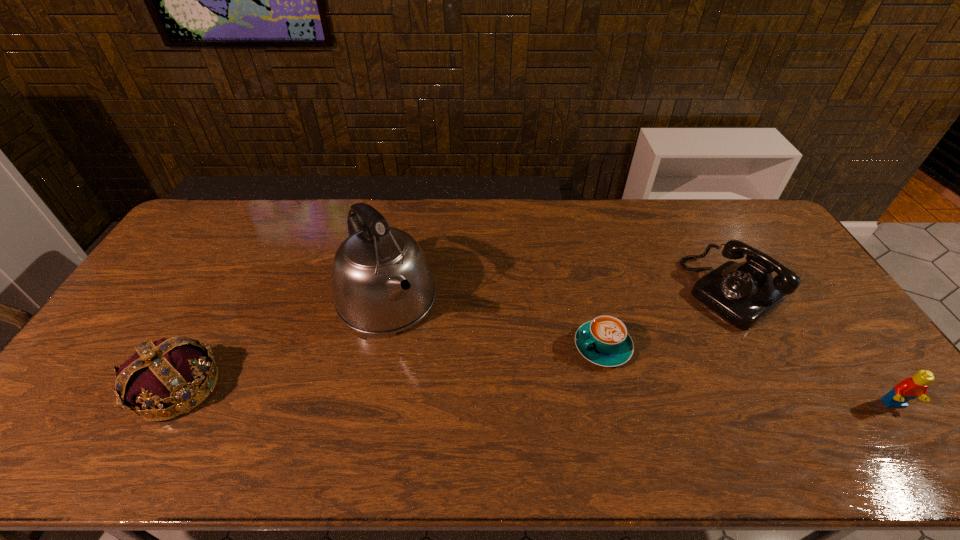
Where is `empty space that is in between the cappuccino and the Lego`? empty space that is in between the cappuccino and the Lego is located at coordinates (749, 376).

Where is `free space between the Lego and the cappuccino`? The image size is (960, 540). free space between the Lego and the cappuccino is located at coordinates (749, 376).

You are a GUI agent. You are given a task and a screenshot of the screen. Output one action in this format:
    pyautogui.click(x=<x>, y=<y>)
    Task: Click on the vacant area that lies between the rightmost object and the crown
    The height and width of the screenshot is (540, 960).
    Given the screenshot: What is the action you would take?
    pyautogui.click(x=536, y=396)

Locate an element on the screen. The height and width of the screenshot is (540, 960). vacant space that is in between the telephone and the cappuccino is located at coordinates (667, 319).

What are the coordinates of `free spot between the second object from left to right and the telephone` in the screenshot? It's located at (559, 296).

Identify the location of empty location between the crown and the tallest object. The image size is (960, 540). (282, 344).

The width and height of the screenshot is (960, 540). What are the coordinates of `free space between the telephone and the cappuccino` in the screenshot? It's located at (667, 319).

Where is `free space between the shortest object and the telephone`? The image size is (960, 540). free space between the shortest object and the telephone is located at coordinates (667, 319).

In order to click on vacant area that lies between the telephone and the Lego in this screenshot , I will do `click(813, 348)`.

Where is `object that ranks as the third closest to the crown`? The image size is (960, 540). object that ranks as the third closest to the crown is located at coordinates (744, 293).